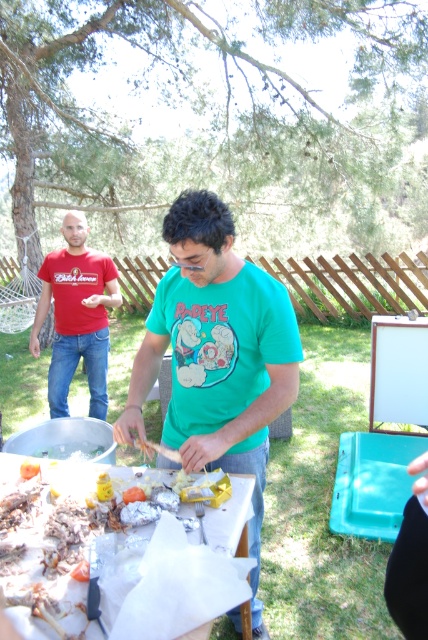
Question: Can you confirm if matte red t-shirt at left is positioned to the right of white paper at center?

Choices:
 (A) no
 (B) yes

Answer: (A)

Question: Among these objects, which one is farthest from the camera?

Choices:
 (A) white paper at center
 (B) matte red t-shirt at left
 (C) green matte shirt at center

Answer: (B)

Question: Which is nearer to the white paper at center?

Choices:
 (A) matte red t-shirt at left
 (B) green matte shirt at center

Answer: (B)

Question: Estimate the real-world distances between objects in this image. Which object is farther from the green matte shirt at center?

Choices:
 (A) white paper at center
 (B) matte red t-shirt at left

Answer: (B)

Question: From the image, what is the correct spatial relationship of matte red t-shirt at left in relation to white paper at center?

Choices:
 (A) left
 (B) right

Answer: (A)

Question: Does matte red t-shirt at left appear on the left side of white paper at center?

Choices:
 (A) yes
 (B) no

Answer: (A)